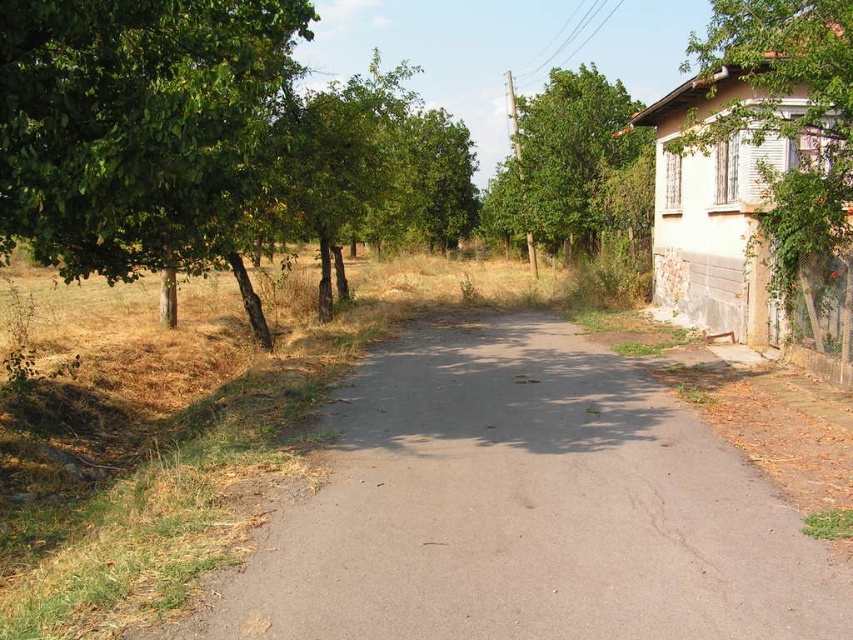
Question: Which point is closer to the camera?

Choices:
 (A) green leafy tree at upper right
 (B) gray asphalt road at center
 (C) white concrete house at right

Answer: (B)

Question: Among these objects, which one is nearest to the camera?

Choices:
 (A) gray asphalt road at center
 (B) green leafy tree at upper right

Answer: (A)

Question: Is gray asphalt road at center thinner than green leafy tree at upper right?

Choices:
 (A) yes
 (B) no

Answer: (A)

Question: Which of the following is the closest to the observer?

Choices:
 (A) (59, 180)
 (B) (521, 234)

Answer: (A)

Question: Is gray asphalt road at center below green leafy tree at left?

Choices:
 (A) yes
 (B) no

Answer: (A)

Question: Does green leafy tree at left come in front of white concrete house at right?

Choices:
 (A) yes
 (B) no

Answer: (A)